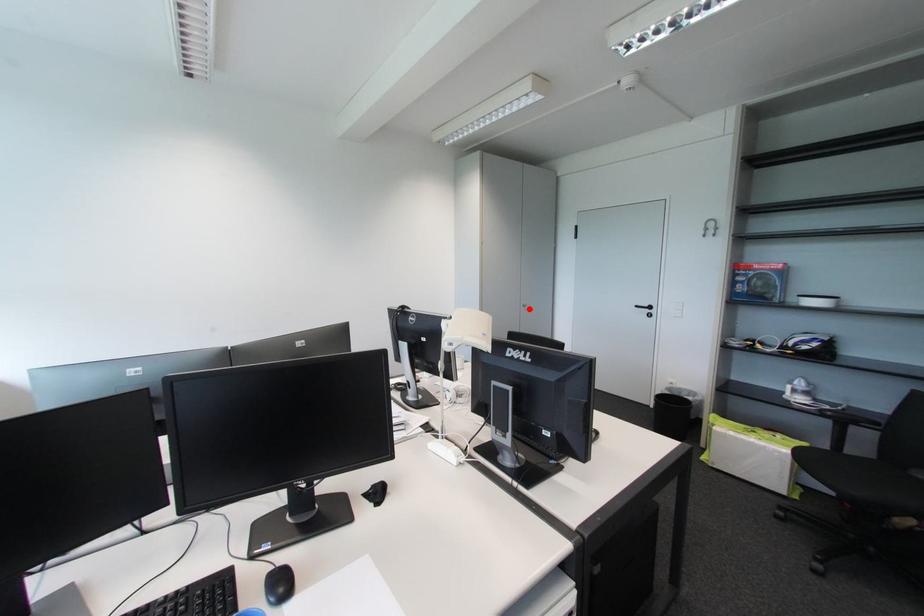
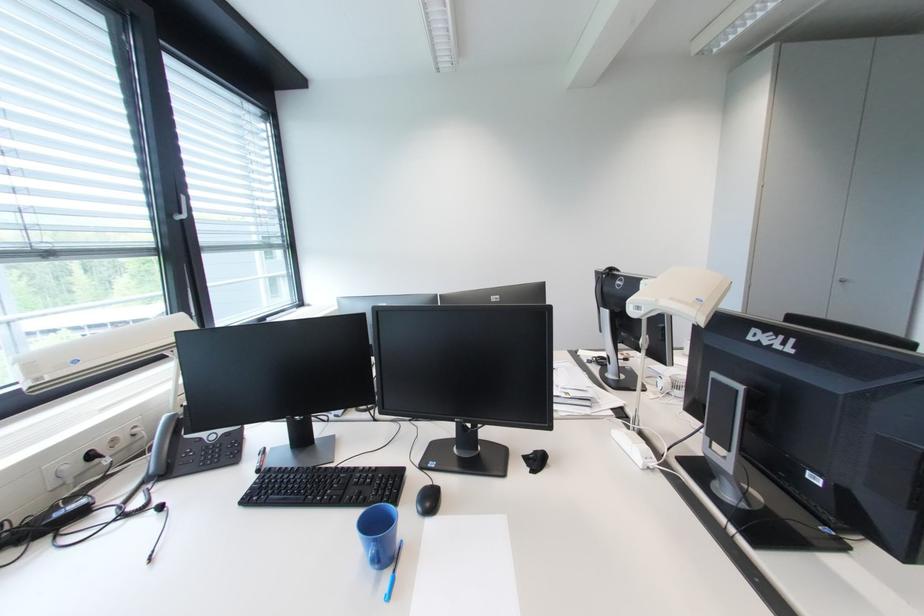
Find the pixel in the second image that matches the highlighted location in the first image.

(844, 285)